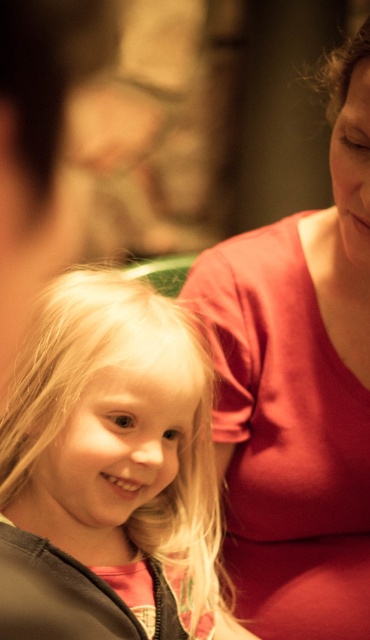
Question: Among these objects, which one is nearest to the camera?

Choices:
 (A) matte red shirt at upper right
 (B) blonde hair at center

Answer: (A)

Question: Among these points, which one is farthest from the camera?

Choices:
 (A) (318, 378)
 (B) (212, 387)

Answer: (A)

Question: Is matte red shirt at upper right above blonde hair at center?

Choices:
 (A) no
 (B) yes

Answer: (B)

Question: Can you confirm if matte red shirt at upper right is positioned below blonde hair at center?

Choices:
 (A) yes
 (B) no

Answer: (B)

Question: Which object appears closest to the camera in this image?

Choices:
 (A) blonde hair at center
 (B) matte red shirt at upper right

Answer: (B)

Question: Is matte red shirt at upper right above blonde hair at center?

Choices:
 (A) yes
 (B) no

Answer: (A)